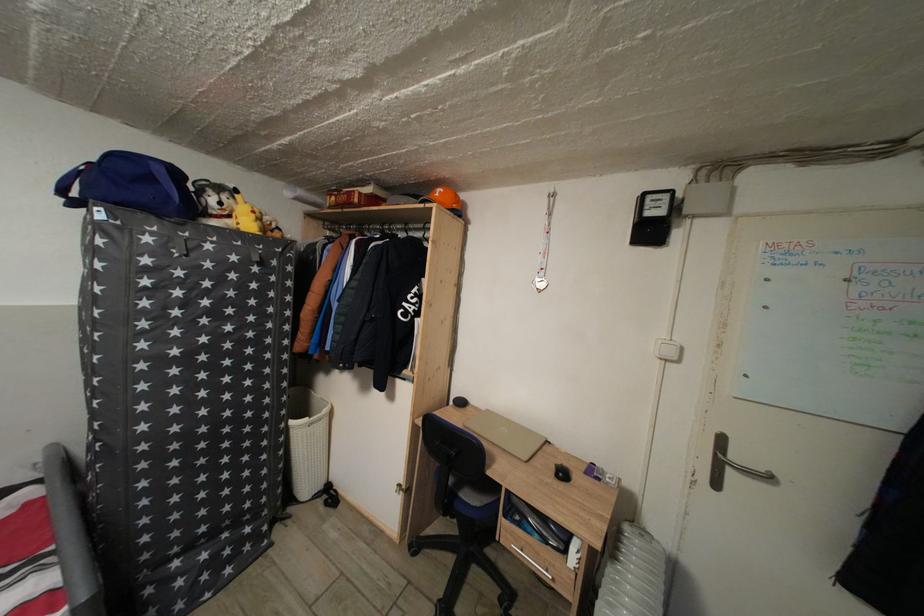
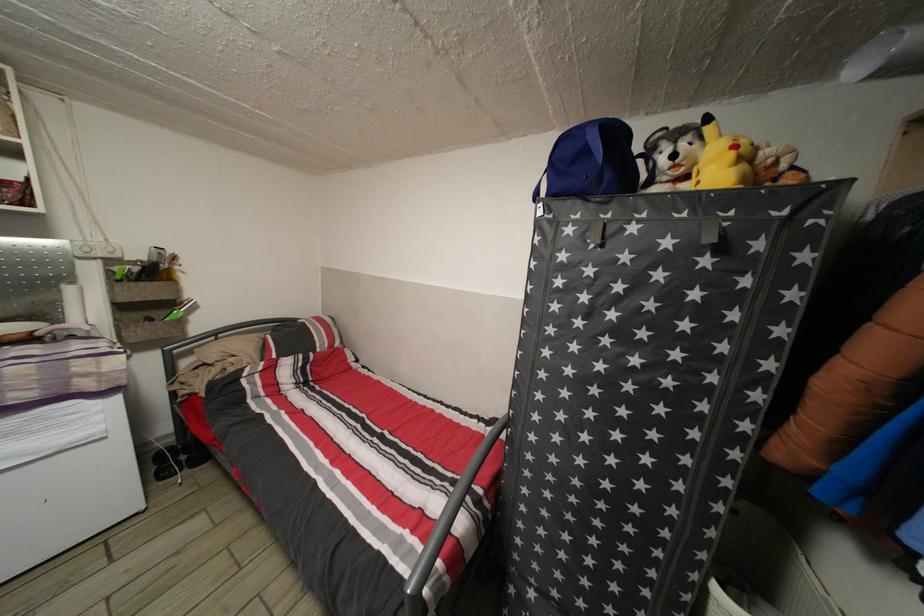
Find the pixel in the second image that matches the point at 261,223 in the first image.

(738, 161)